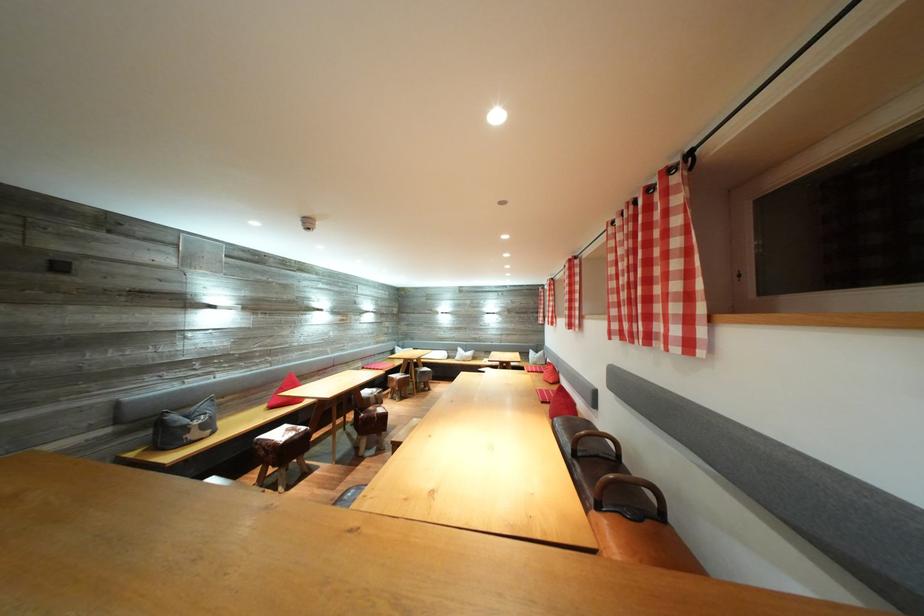
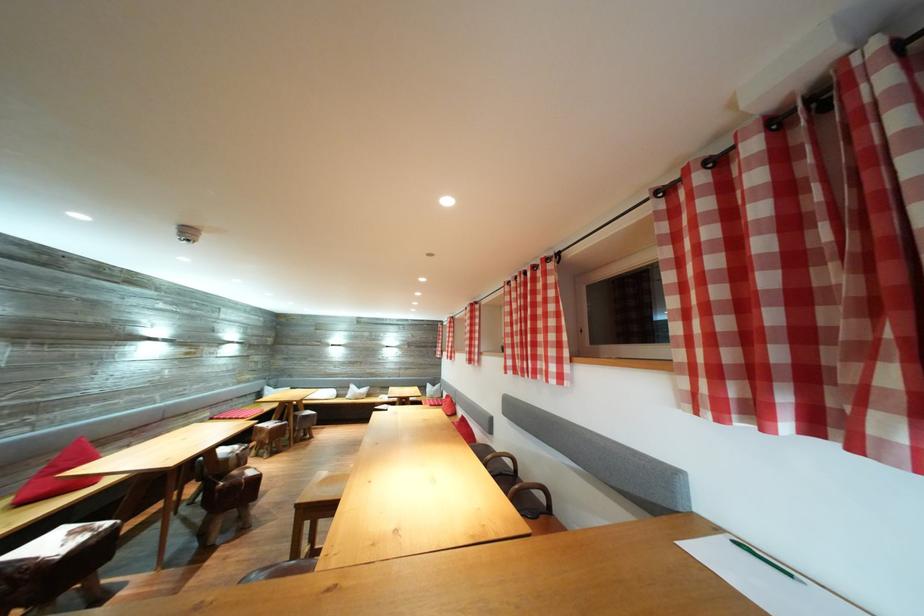
Find the pixel in the second image that matches (299,435) in the first image.

(91, 536)